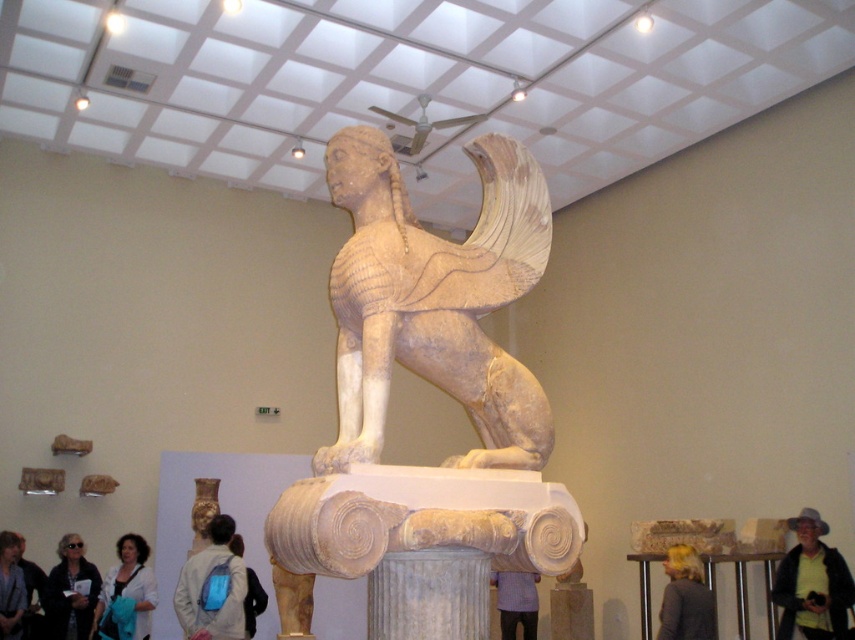
Question: Among these objects, which one is farthest from the camera?

Choices:
 (A) light blue backpack at center
 (B) beige stone sphinx at center
 (C) yellow-green shirt at center

Answer: (A)

Question: Can you confirm if purple fabric shirt at center is smaller than light blue backpack at center?

Choices:
 (A) no
 (B) yes

Answer: (A)

Question: Based on their relative distances, which object is nearer to the matte white jacket at lower left?

Choices:
 (A) blonde hair at lower right
 (B) light gray backpack at lower left
 (C) matte white shirt at lower left
 (D) yellow-green shirt at center

Answer: (C)

Question: From the image, what is the correct spatial relationship of beige stone sphinx at center in relation to white marble column at center?

Choices:
 (A) left
 (B) right

Answer: (B)

Question: Observing the image, what is the correct spatial positioning of matte white jacket at lower left in reference to blonde hair at lower right?

Choices:
 (A) left
 (B) right

Answer: (A)

Question: Which object is positioned closest to the purple fabric shirt at center?

Choices:
 (A) matte white jacket at lower left
 (B) light gray backpack at lower left
 (C) white marble column at center

Answer: (B)